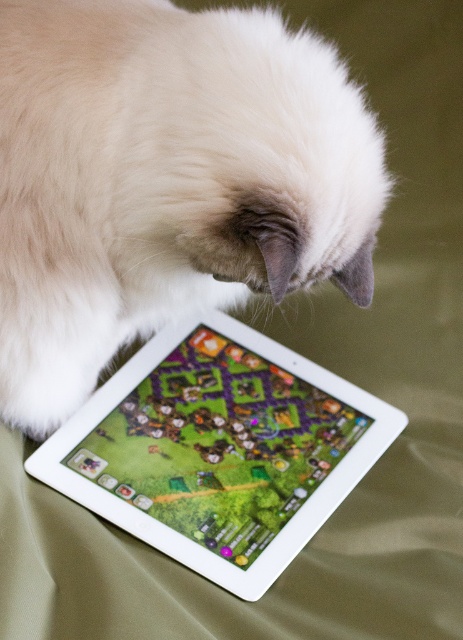
You are a robotic arm that needs to pick up the white glossy tablet at upper center. The robotic arm can reach up to 12 inches. Is the white fluffy cat at center within the robotic arm reach of the tablet?

The distance between the white fluffy cat at center and the white glossy tablet at upper center is 12.58 inches, which exceeds the robotic arm reach of 12 inches. Therefore, the robotic arm cannot reach the tablet while the cat is that close.

You are a photographer trying to capture the white fluffy cat at center and the white glossy tablet at upper center in a single shot. Given that your camera can only focus on objects larger than 10 cm, will both objects be in focus?

The white fluffy cat at center is bigger than the white glossy tablet at upper center, but the exact sizes aren not provided. However, since the cat is larger and the tablet is at upper center, it is likely both are within the focus range if the camera is set appropriately.